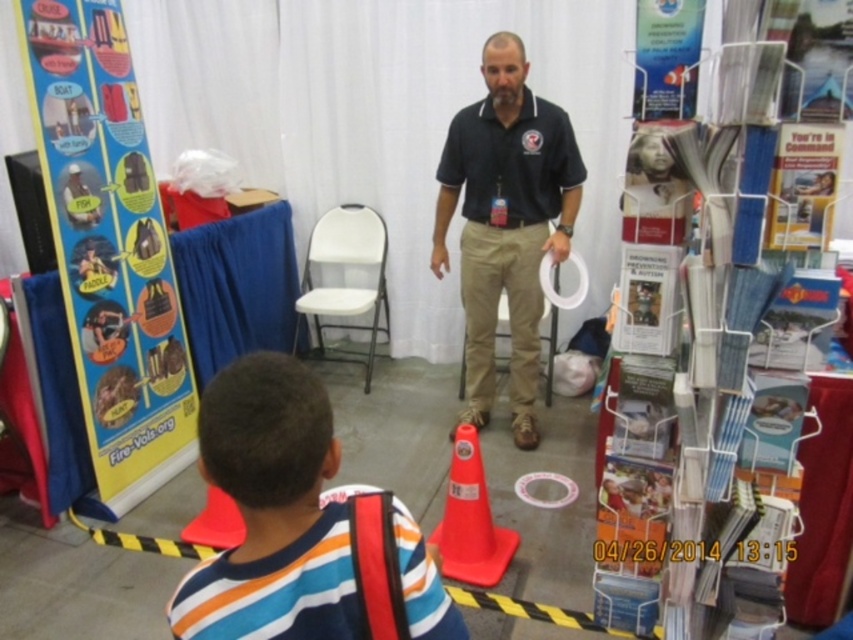
Who is more distant from viewer, (477, 353) or (448, 564)?

Positioned behind is point (477, 353).

Find the location of `black cotton shirt at center`. black cotton shirt at center is located at coordinates (505, 221).

The image size is (853, 640). Identify the location of black cotton shirt at center. (505, 221).

Based on the photo, who is positioned more to the right, striped cotton shirt at lower left or black cotton shirt at center?

black cotton shirt at center

Which is below, striped cotton shirt at lower left or black cotton shirt at center?

striped cotton shirt at lower left is lower down.

This screenshot has width=853, height=640. What are the coordinates of `striped cotton shirt at lower left` in the screenshot? It's located at (271, 509).

At what (x,y) coordinates should I click in order to perform the action: click on striped cotton shirt at lower left. Please return your answer as a coordinate pair (x, y). Image resolution: width=853 pixels, height=640 pixels. Looking at the image, I should click on (271, 509).

Image resolution: width=853 pixels, height=640 pixels. What do you see at coordinates (271, 509) in the screenshot?
I see `striped cotton shirt at lower left` at bounding box center [271, 509].

Does striped cotton shirt at lower left have a greater height compared to rubberized orange cone at center?

No, striped cotton shirt at lower left is not taller than rubberized orange cone at center.

Image resolution: width=853 pixels, height=640 pixels. Find the location of `striped cotton shirt at lower left`. striped cotton shirt at lower left is located at coordinates (271, 509).

The height and width of the screenshot is (640, 853). Find the location of `striped cotton shirt at lower left`. striped cotton shirt at lower left is located at coordinates (271, 509).